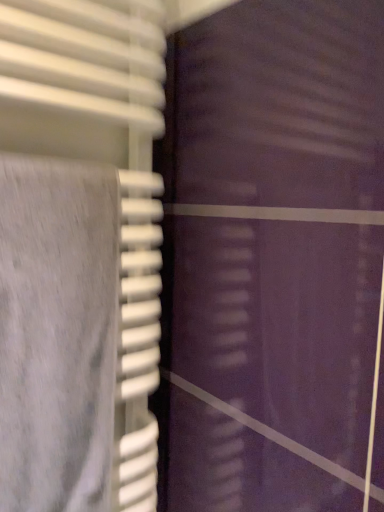
This screenshot has width=384, height=512. What do you see at coordinates (57, 333) in the screenshot? I see `white textured towel at left` at bounding box center [57, 333].

You are a GUI agent. You are given a task and a screenshot of the screen. Output one action in this format:
    pyautogui.click(x=<x>, y=<y>)
    Task: Click on the white textured towel at left
    The width and height of the screenshot is (384, 512).
    Given the screenshot: What is the action you would take?
    (57, 333)

Measure the distance between white textured towel at left and camera.

A distance of 21.04 inches exists between white textured towel at left and camera.

This screenshot has width=384, height=512. What are the coordinates of `white textured towel at left` in the screenshot? It's located at (57, 333).